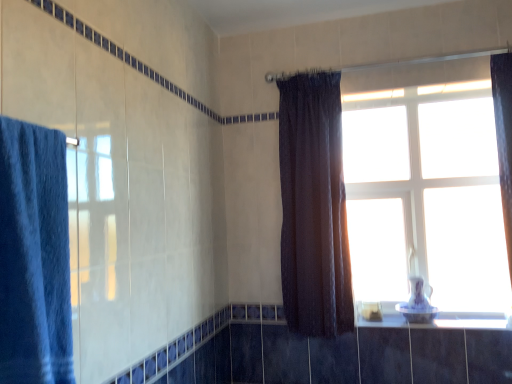
Question: From a real-world perspective, is blue fabric towel at left, the 2th curtain in the back-to-front sequence, on white glossy window sill at lower right?

Choices:
 (A) yes
 (B) no

Answer: (A)

Question: Does blue fabric towel at left, which is the 1th curtain from front to back, have a lesser width compared to white glossy window sill at lower right?

Choices:
 (A) yes
 (B) no

Answer: (A)

Question: Is blue fabric towel at left, which is the 1th curtain from front to back, shorter than white glossy window sill at lower right?

Choices:
 (A) yes
 (B) no

Answer: (B)

Question: Is there a large distance between blue fabric towel at left, the 2th curtain in the back-to-front sequence, and white glossy window sill at lower right?

Choices:
 (A) no
 (B) yes

Answer: (B)

Question: Considering the relative positions of blue fabric towel at left, the 2th curtain in the back-to-front sequence, and white glossy window sill at lower right in the image provided, is blue fabric towel at left, the 2th curtain in the back-to-front sequence, to the right of white glossy window sill at lower right from the viewer's perspective?

Choices:
 (A) yes
 (B) no

Answer: (B)

Question: Based on their positions, is white glass window at upper right located to the left or right of dark brown sheer curtain at center, which is the 1th curtain from back to front?

Choices:
 (A) right
 (B) left

Answer: (A)

Question: Which is correct: white glass window at upper right is inside dark brown sheer curtain at center, the 2th curtain positioned from the left, or outside of it?

Choices:
 (A) outside
 (B) inside

Answer: (A)

Question: From the image's perspective, relative to dark brown sheer curtain at center, which is the 1th curtain from back to front, is white glass window at upper right above or below?

Choices:
 (A) below
 (B) above

Answer: (A)

Question: Considering the positions of white glass window at upper right and dark brown sheer curtain at center, the second curtain viewed from the front, in the image, is white glass window at upper right taller or shorter than dark brown sheer curtain at center, the second curtain viewed from the front,?

Choices:
 (A) tall
 (B) short

Answer: (B)

Question: Is white glass window at upper right taller or shorter than blue fabric towel at left, which is the 1th curtain from front to back?

Choices:
 (A) tall
 (B) short

Answer: (A)

Question: Is point (492, 231) closer or farther from the camera than point (41, 228)?

Choices:
 (A) closer
 (B) farther

Answer: (B)

Question: Would you say white glass window at upper right is to the left or to the right of blue fabric towel at left, which is the 1th curtain from front to back, in the picture?

Choices:
 (A) right
 (B) left

Answer: (A)

Question: From the image's perspective, is white glass window at upper right located above or below blue fabric towel at left, which is the 1th curtain from left to right?

Choices:
 (A) above
 (B) below

Answer: (A)

Question: Is point [x=327, y=180] positioned closer to the camera than point [x=26, y=172]?

Choices:
 (A) closer
 (B) farther

Answer: (B)

Question: From a real-world perspective, is dark brown sheer curtain at center, the second curtain viewed from the front, positioned above or below blue fabric towel at left, the 2th curtain in the back-to-front sequence?

Choices:
 (A) below
 (B) above

Answer: (B)